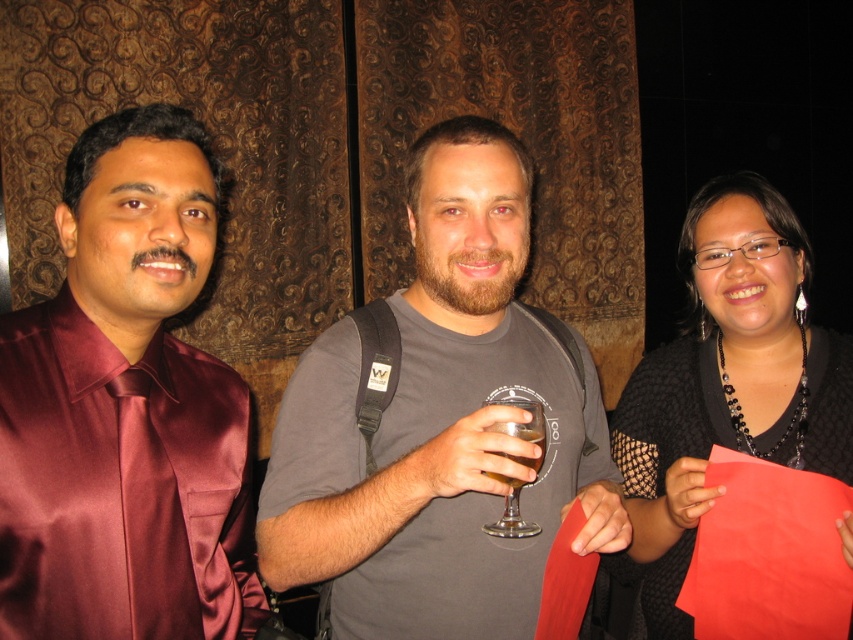
In the scene shown: You are standing in front of the three people in the image. You want to place a small gift box between the two points marked as point (274,452) and point (514,480). Which point should the gift box be closer to in order to be closer to the viewer?

The gift box should be placed closer to point (274,452) because it is closer to the viewer than point (514,480).